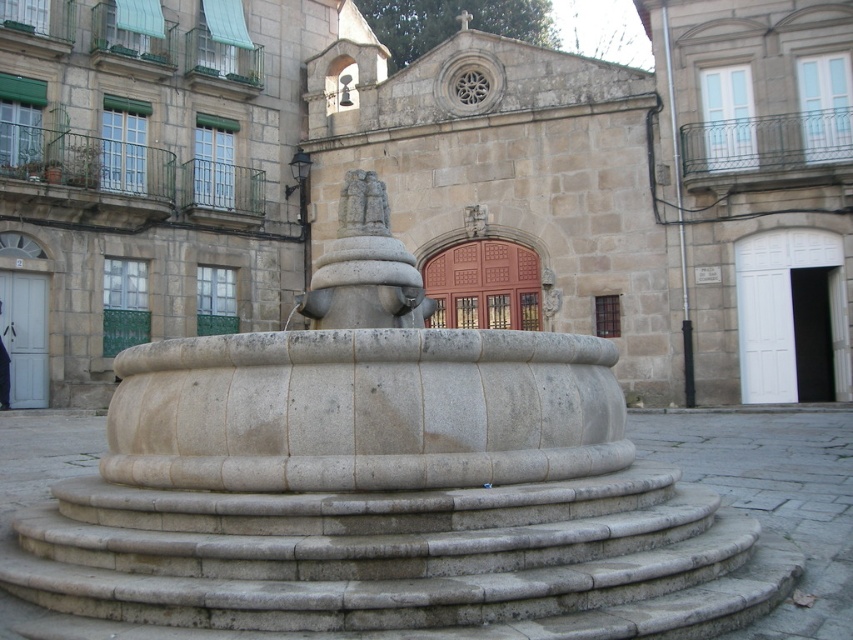
You are a tourist standing in the town square and want to take a photo that includes both the smooth stone fountain at center and the gray stone statue at center. Which object should you position closer to the camera to ensure both are fully visible in the frame?

You should position the smooth stone fountain at center closer to the camera because it has a lesser height compared to the gray stone statue at center, ensuring both fit within the frame.

You are standing in the town square and want to approach both the smooth stone stairs at center and the gray stone statue at center. Which object will you encounter first as you move forward?

You will encounter the smooth stone stairs at center first because it is closer to you than the gray stone statue at center.

You are standing at the base of the fountain and want to reach the top of the smooth stone stairs at center. According to the coordinates provided, in which direction should you move relative to your current position?

The smooth stone stairs at center is located at point (x=392, y=550), which means it is positioned to the right and slightly forward from your current position at the base of the fountain. You should move towards the right and forward to reach it.